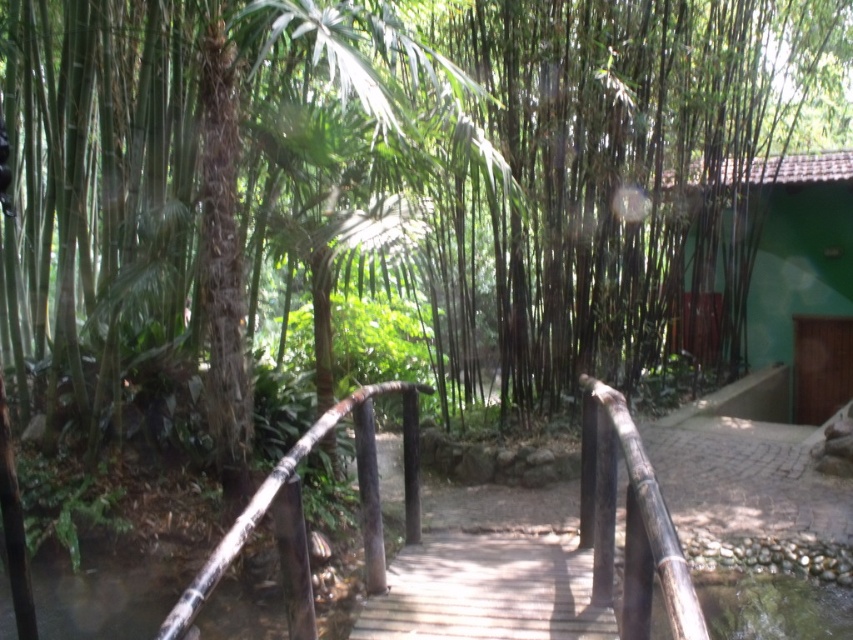
You are a hiker who wants to know if the green matte hut at right can be seen from the brown rough bamboo rail at center. Based on their heights, is it possible?

The green matte hut at right has a greater height compared to the brown rough bamboo rail at center, so yes, the hut can be seen from the rail as it is taller and likely not obstructed by the shorter rail.

You are standing on the wooden bridge in the image and want to determine the relative positions of two points marked on the bridge planks. Which point, point [602,424] or point [422,387], is closer to you?

Point [602,424] is closer to the camera than point [422,387], so the point closer to you is point [602,424].